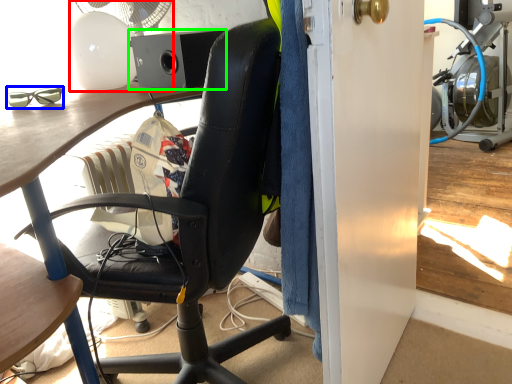
Question: Which object is positioned farthest from mechanical fan (highlighted by a red box)? Select from glasses (highlighted by a blue box) and loudspeaker (highlighted by a green box).

Choices:
 (A) glasses
 (B) loudspeaker

Answer: (A)